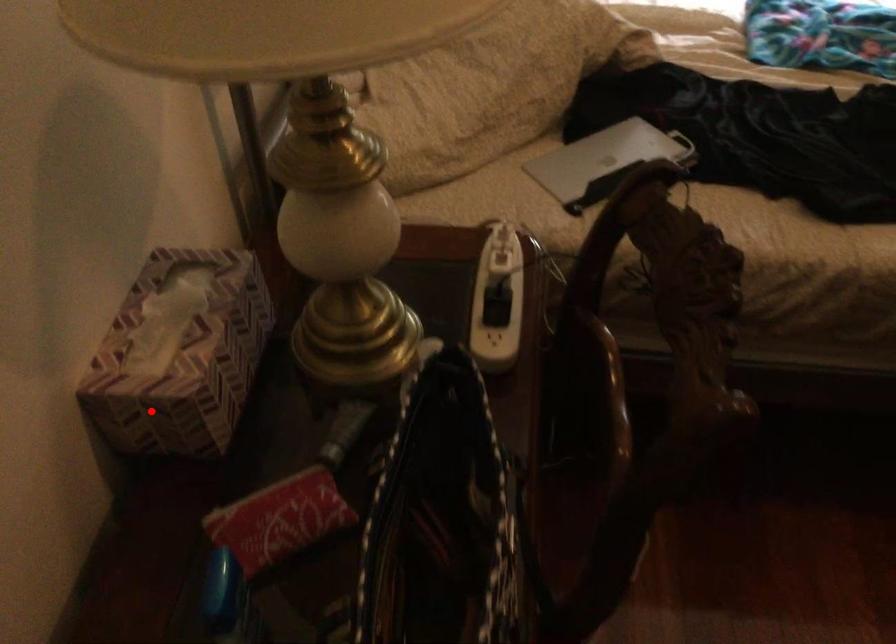
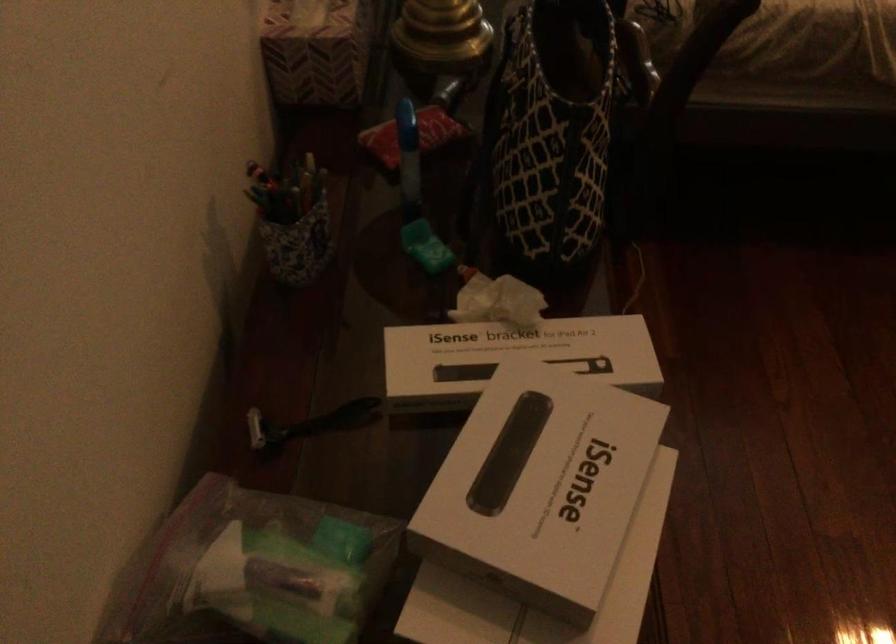
Question: I am providing you with two images of the same scene from different viewpoints. A red point is shown in image1. For the corresponding object point in image2, is it positioned nearer or farther from the camera?

Choices:
 (A) Nearer
 (B) Farther

Answer: (B)